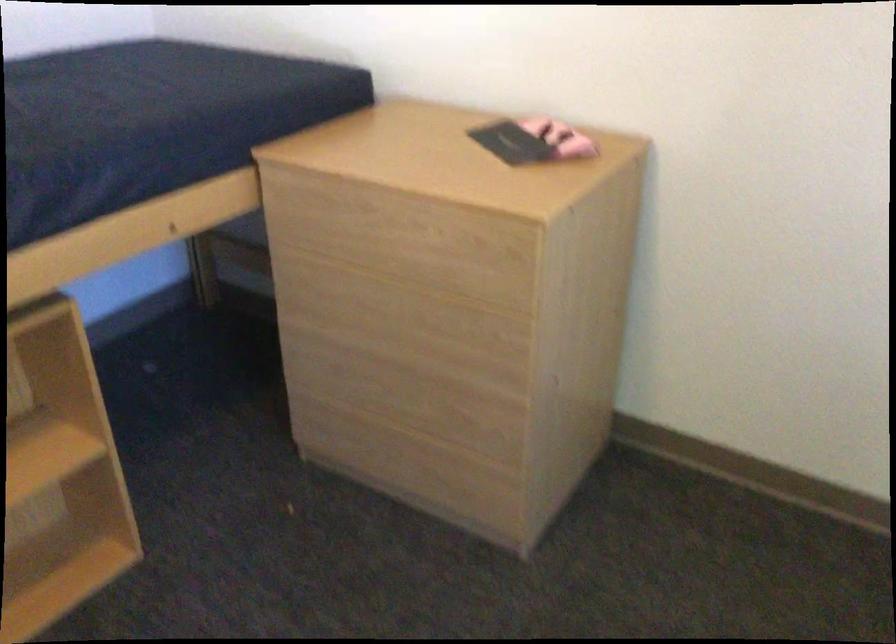
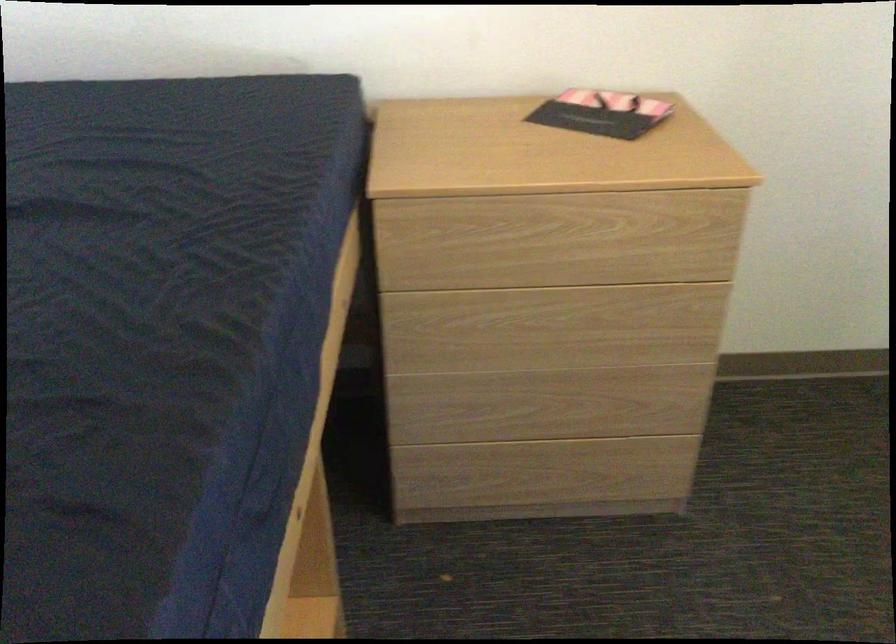
Locate, in the second image, the point that corresponds to the point at 524,140 in the first image.

(600, 113)